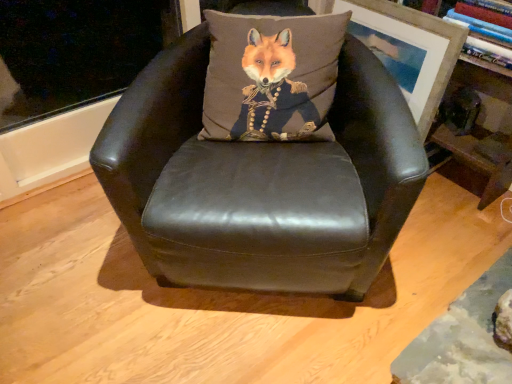
Question: Is wooden picture frame at upper right looking in the opposite direction of matte black leather chair at center?

Choices:
 (A) yes
 (B) no

Answer: (B)

Question: Does wooden picture frame at upper right appear on the left side of matte black leather chair at center?

Choices:
 (A) yes
 (B) no

Answer: (B)

Question: Is wooden picture frame at upper right shorter than matte black leather chair at center?

Choices:
 (A) no
 (B) yes

Answer: (B)

Question: Would you say wooden picture frame at upper right contains matte black leather chair at center?

Choices:
 (A) yes
 (B) no

Answer: (B)

Question: Can you confirm if wooden picture frame at upper right is wider than matte black leather chair at center?

Choices:
 (A) yes
 (B) no

Answer: (B)

Question: In terms of width, does wooden picture frame at upper right look wider or thinner when compared to wooden bookshelf at upper right?

Choices:
 (A) wide
 (B) thin

Answer: (B)

Question: Is wooden picture frame at upper right in front of or behind wooden bookshelf at upper right in the image?

Choices:
 (A) front
 (B) behind

Answer: (B)

Question: Is wooden picture frame at upper right to the left or to the right of wooden bookshelf at upper right in the image?

Choices:
 (A) left
 (B) right

Answer: (A)

Question: From a real-world perspective, is wooden picture frame at upper right physically located above or below wooden bookshelf at upper right?

Choices:
 (A) below
 (B) above

Answer: (B)

Question: Considering the relative positions of matte black leather chair at center and wooden picture frame at upper right in the image provided, is matte black leather chair at center to the left or to the right of wooden picture frame at upper right?

Choices:
 (A) left
 (B) right

Answer: (A)

Question: Based on their sizes in the image, would you say matte black leather chair at center is bigger or smaller than wooden picture frame at upper right?

Choices:
 (A) big
 (B) small

Answer: (A)

Question: In the image, is matte black leather chair at center positioned in front of or behind wooden picture frame at upper right?

Choices:
 (A) front
 (B) behind

Answer: (A)

Question: Would you say matte black leather chair at center is inside or outside wooden picture frame at upper right?

Choices:
 (A) outside
 (B) inside

Answer: (A)

Question: Based on their positions, is wooden bookshelf at upper right located to the left or right of wooden picture frame at upper right?

Choices:
 (A) left
 (B) right

Answer: (B)

Question: From the image's perspective, is wooden bookshelf at upper right located above or below wooden picture frame at upper right?

Choices:
 (A) above
 (B) below

Answer: (B)